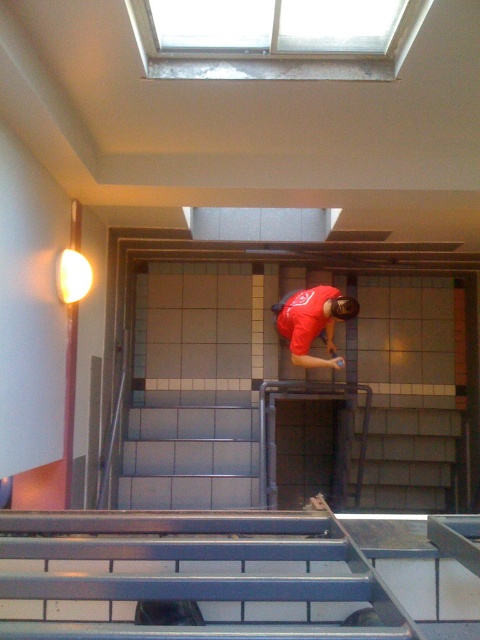
Is metallic gray stairs at center bigger than matte red shirt at center?

Correct, metallic gray stairs at center is larger in size than matte red shirt at center.

Which of these two, metallic gray stairs at center or matte red shirt at center, stands taller?

With more height is metallic gray stairs at center.

The width and height of the screenshot is (480, 640). In order to click on metallic gray stairs at center in this screenshot , I will do `click(191, 451)`.

The width and height of the screenshot is (480, 640). In order to click on metallic gray stairs at center in this screenshot , I will do `click(191, 451)`.